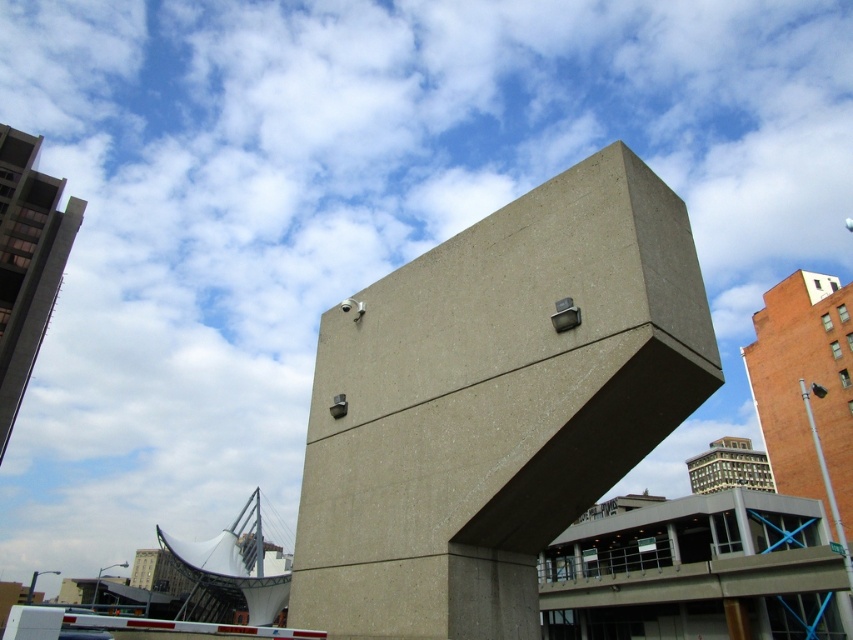
Question: Is gray concrete cube at center to the right of white fabric sculpture at lower left from the viewer's perspective?

Choices:
 (A) yes
 (B) no

Answer: (A)

Question: Does gray concrete cube at center have a greater width compared to white fabric sculpture at lower left?

Choices:
 (A) no
 (B) yes

Answer: (A)

Question: Does gray concrete cube at center lie in front of white fabric sculpture at lower left?

Choices:
 (A) no
 (B) yes

Answer: (B)

Question: Which of the following is the farthest from the observer?

Choices:
 (A) white fabric sculpture at lower left
 (B) gray concrete cube at center

Answer: (A)